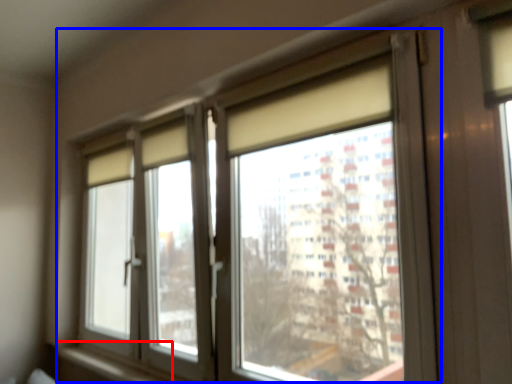
Question: Which point is further to the camera, window sill (highlighted by a red box) or window (highlighted by a blue box)?

Choices:
 (A) window sill
 (B) window

Answer: (A)